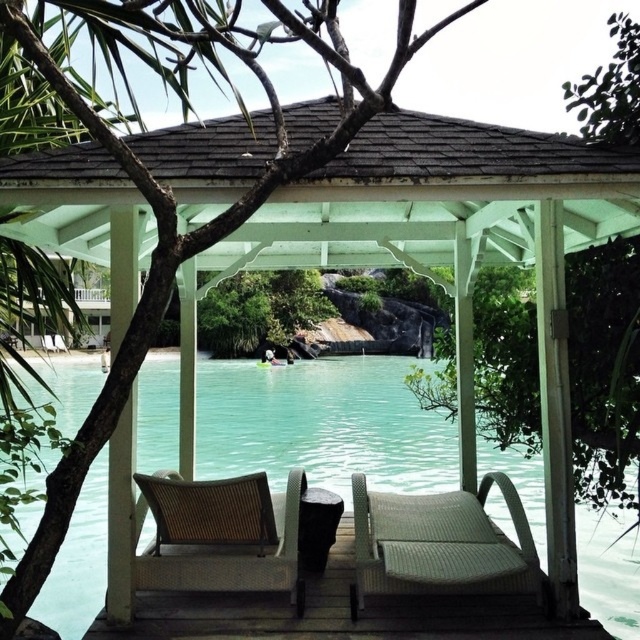
From the picture: Between woven rattan lounge chair at center and woven rattan chair at center, which one appears on the right side from the viewer's perspective?

woven rattan lounge chair at center

Between woven rattan lounge chair at center and woven rattan chair at center, which one has more height?

woven rattan chair at center is taller.

Image resolution: width=640 pixels, height=640 pixels. What do you see at coordinates (440, 544) in the screenshot?
I see `woven rattan lounge chair at center` at bounding box center [440, 544].

Image resolution: width=640 pixels, height=640 pixels. I want to click on woven rattan lounge chair at center, so click(x=440, y=544).

Does turquoise water at center have a larger size compared to woven rattan chair at center?

Correct, turquoise water at center is larger in size than woven rattan chair at center.

Is point (364, 424) closer to camera compared to point (285, 563)?

No, (364, 424) is further to viewer.

Find the location of a particular element. turquoise water at center is located at coordinates (323, 424).

In the scene shown: How much distance is there between turquoise water at center and woven rattan lounge chair at center?

turquoise water at center is 8.60 feet from woven rattan lounge chair at center.

Is turquoise water at center wider than woven rattan lounge chair at center?

Answer: Yes.

Where is `turquoise water at center`? Image resolution: width=640 pixels, height=640 pixels. turquoise water at center is located at coordinates (323, 424).

Identify the location of turquoise water at center. This screenshot has height=640, width=640. (323, 424).